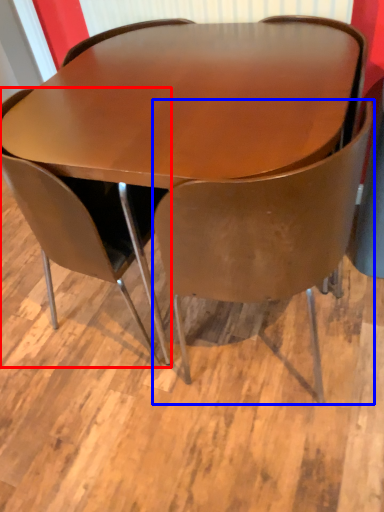
Question: Which of the following is the farthest to the observer, chair (highlighted by a red box) or chair (highlighted by a blue box)?

Choices:
 (A) chair
 (B) chair

Answer: (A)